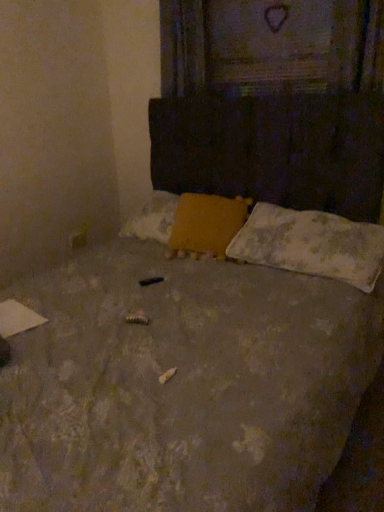
Question: From the image's perspective, does wooden textured frame at upper center appear higher than yellow fabric pillow at center, acting as the 1th pillow starting from the left?

Choices:
 (A) yes
 (B) no

Answer: (A)

Question: Does wooden textured frame at upper center have a greater width compared to yellow fabric pillow at center, acting as the 1th pillow starting from the left?

Choices:
 (A) yes
 (B) no

Answer: (B)

Question: Can you confirm if wooden textured frame at upper center is bigger than yellow fabric pillow at center, acting as the 1th pillow starting from the left?

Choices:
 (A) no
 (B) yes

Answer: (A)

Question: From the image's perspective, would you say wooden textured frame at upper center is shown under yellow fabric pillow at center, acting as the 1th pillow starting from the left?

Choices:
 (A) no
 (B) yes

Answer: (A)

Question: Is yellow fabric pillow at center, which is counted as the second pillow, starting from the right, at the back of wooden textured frame at upper center?

Choices:
 (A) yes
 (B) no

Answer: (B)

Question: Considering the relative sizes of wooden textured frame at upper center and yellow fabric pillow at center, acting as the 1th pillow starting from the left, in the image provided, is wooden textured frame at upper center shorter than yellow fabric pillow at center, acting as the 1th pillow starting from the left,?

Choices:
 (A) no
 (B) yes

Answer: (A)

Question: Is white textured pillow at lower right, the first pillow in the right-to-left sequence, shorter than wooden textured frame at upper center?

Choices:
 (A) no
 (B) yes

Answer: (B)

Question: Is white textured pillow at lower right, which ranks as the second pillow in left-to-right order, at the right side of wooden textured frame at upper center?

Choices:
 (A) yes
 (B) no

Answer: (A)

Question: Is white textured pillow at lower right, the first pillow in the right-to-left sequence, taller than wooden textured frame at upper center?

Choices:
 (A) yes
 (B) no

Answer: (B)

Question: Considering the relative sizes of white textured pillow at lower right, which ranks as the second pillow in left-to-right order, and wooden textured frame at upper center in the image provided, is white textured pillow at lower right, which ranks as the second pillow in left-to-right order, thinner than wooden textured frame at upper center?

Choices:
 (A) no
 (B) yes

Answer: (A)

Question: Is white textured pillow at lower right, the first pillow in the right-to-left sequence, positioned behind wooden textured frame at upper center?

Choices:
 (A) no
 (B) yes

Answer: (A)

Question: Can you confirm if white textured pillow at lower right, which ranks as the second pillow in left-to-right order, is smaller than wooden textured frame at upper center?

Choices:
 (A) no
 (B) yes

Answer: (A)

Question: Is yellow fabric pillow at center, acting as the 1th pillow starting from the left, thinner than wooden textured frame at upper center?

Choices:
 (A) no
 (B) yes

Answer: (A)